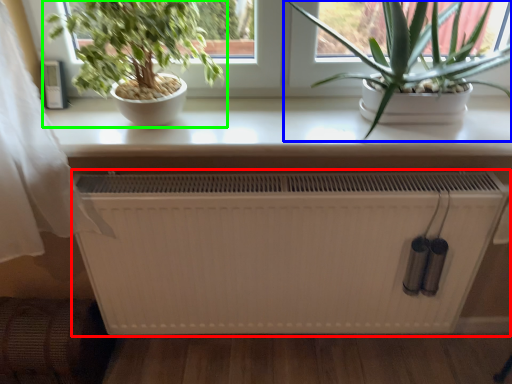
Question: Which object is positioned farthest from heater (highlighted by a red box)? Select from houseplant (highlighted by a blue box) and houseplant (highlighted by a green box).

Choices:
 (A) houseplant
 (B) houseplant

Answer: (B)